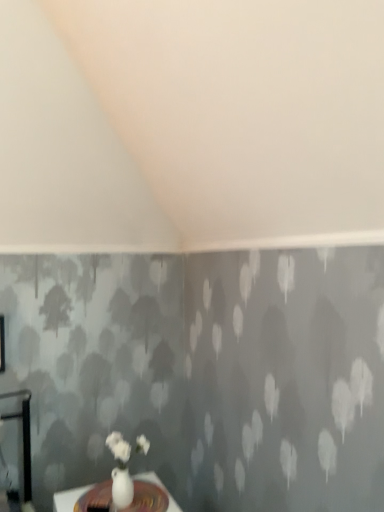
Question: Does white glossy vase at lower center have a greater width compared to white glossy vase at lower center?

Choices:
 (A) yes
 (B) no

Answer: (A)

Question: Is white glossy vase at lower center thinner than white glossy vase at lower center?

Choices:
 (A) yes
 (B) no

Answer: (B)

Question: Is white glossy vase at lower center a part of white glossy vase at lower center?

Choices:
 (A) no
 (B) yes

Answer: (A)

Question: Is white glossy vase at lower center behind white glossy vase at lower center?

Choices:
 (A) yes
 (B) no

Answer: (B)

Question: Does white glossy vase at lower center appear on the left side of white glossy vase at lower center?

Choices:
 (A) yes
 (B) no

Answer: (A)

Question: Can you confirm if white glossy vase at lower center is smaller than white glossy vase at lower center?

Choices:
 (A) no
 (B) yes

Answer: (A)

Question: Is white glossy vase at lower center surrounding white glossy vase at lower center?

Choices:
 (A) yes
 (B) no

Answer: (B)

Question: From a real-world perspective, is white glossy vase at lower center positioned under white glossy vase at lower center based on gravity?

Choices:
 (A) no
 (B) yes

Answer: (A)

Question: Is white glossy vase at lower center positioned in front of white glossy vase at lower center?

Choices:
 (A) no
 (B) yes

Answer: (A)

Question: Does white glossy vase at lower center have a larger size compared to white glossy vase at lower center?

Choices:
 (A) yes
 (B) no

Answer: (B)

Question: Does white glossy vase at lower center turn towards white glossy vase at lower center?

Choices:
 (A) yes
 (B) no

Answer: (B)

Question: Is white glossy vase at lower center completely or partially outside of white glossy vase at lower center?

Choices:
 (A) no
 (B) yes

Answer: (B)

Question: Is white glossy vase at lower center inside or outside of white glossy vase at lower center?

Choices:
 (A) inside
 (B) outside

Answer: (B)